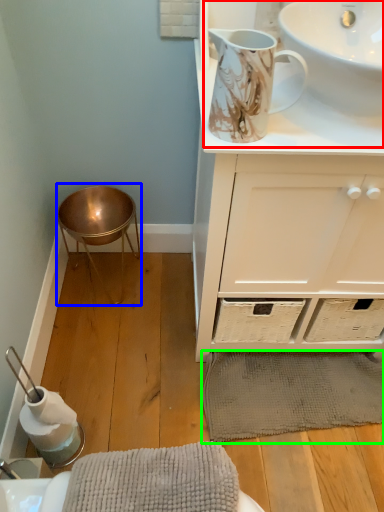
Question: Which object is the closest to the sink (highlighted by a red box)? Choose among these: bar stool (highlighted by a blue box) or bath mat (highlighted by a green box).

Choices:
 (A) bar stool
 (B) bath mat

Answer: (A)